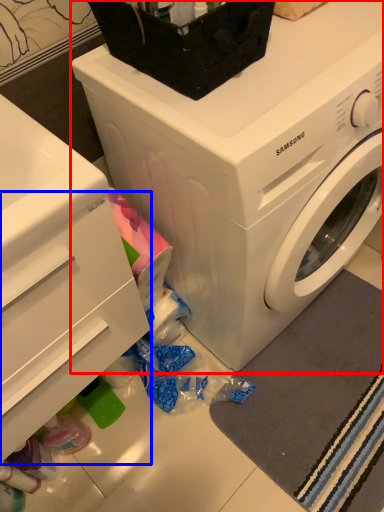
Question: Which object appears closest to the camera in this image, washing machine (highlighted by a red box) or drawer (highlighted by a blue box)?

Choices:
 (A) washing machine
 (B) drawer

Answer: (B)